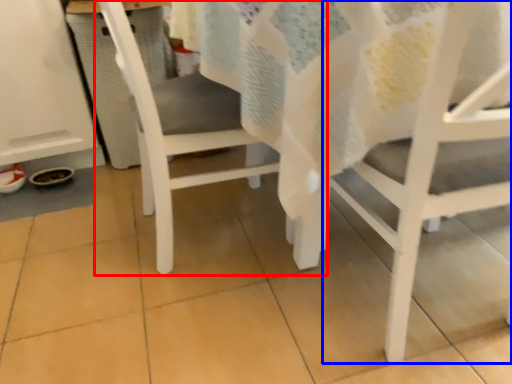
Question: Which object is closer to the camera taking this photo, chair (highlighted by a red box) or chair (highlighted by a blue box)?

Choices:
 (A) chair
 (B) chair

Answer: (B)